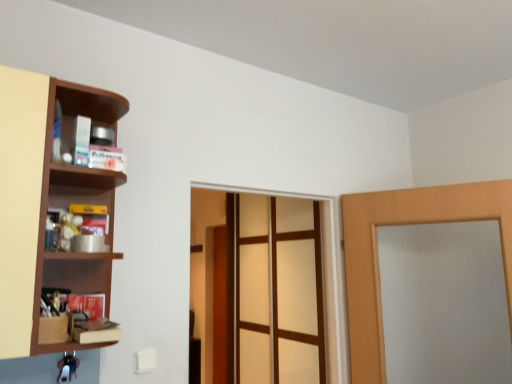
Question: Is translucent glass screen door at center wider or thinner than brown wooden shelf at left?

Choices:
 (A) thin
 (B) wide

Answer: (A)

Question: From the image's perspective, is translucent glass screen door at center above or below brown wooden shelf at left?

Choices:
 (A) above
 (B) below

Answer: (B)

Question: Considering the real-world distances, which object is farthest from the wooden door at center, the 1th door from the left?

Choices:
 (A) translucent glass screen door at center
 (B) brown wooden shelf at left
 (C) light brown wooden door at right, positioned as the 2th door in left-to-right order

Answer: (B)

Question: Which is farther from the brown wooden shelf at left?

Choices:
 (A) translucent glass screen door at center
 (B) light brown wooden door at right, acting as the second door starting from the back
 (C) wooden door at center, arranged as the 1th door when viewed from the back

Answer: (C)